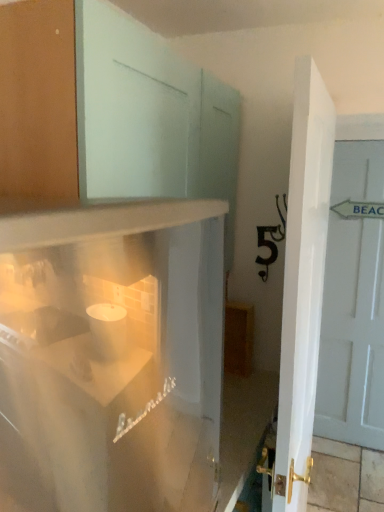
Question: Is white glossy refrigerator at lower left taller or shorter than white glossy door at center, which appears as the 1th door when viewed from the front?

Choices:
 (A) tall
 (B) short

Answer: (B)

Question: Considering the positions of white glossy refrigerator at lower left and white glossy door at center, the second door positioned from the back, in the image, is white glossy refrigerator at lower left bigger or smaller than white glossy door at center, the second door positioned from the back,?

Choices:
 (A) big
 (B) small

Answer: (A)

Question: Estimate the real-world distances between objects in this image. Which object is farther from the white glossy refrigerator at lower left?

Choices:
 (A) white glossy door at center, positioned as the first door in left-to-right order
 (B) white painted wood door at right, which is counted as the 1th door, starting from the right

Answer: (B)

Question: Which is farther from the white glossy door at center, which appears as the 1th door when viewed from the front?

Choices:
 (A) white painted wood door at right, the 2th door from the left
 (B) white glossy refrigerator at lower left

Answer: (A)